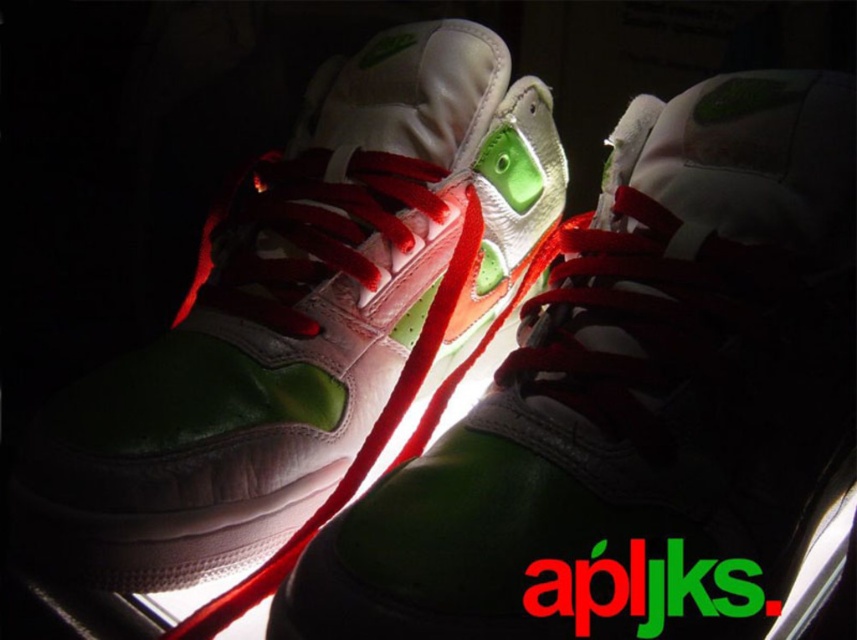
You are trying to decide which pair of sneakers to wear for a casual day out. You have two options in front of you, the green matte running shoe at center and the matte white and green sneakers at center. Based on their width, which one might be more comfortable for walking long distances?

The matte white and green sneakers at center are thicker than the green matte running shoe at center, so they might provide more comfort for walking long distances due to their wider build.

You are a delivery robot that needs to place a package between the green matte running shoe at center and the matte white and green sneakers at center. The package is 12 inches long. Will it fit in the space between them?

The green matte running shoe at center is 11.47 inches away from matte white and green sneakers at center. Since the package is 12 inches long, it will not fit in the space between them as the distance is slightly shorter than the package length.

What object is located at the coordinates point (636, 401)?

The point (636, 401) corresponds to the green matte running shoe at center.